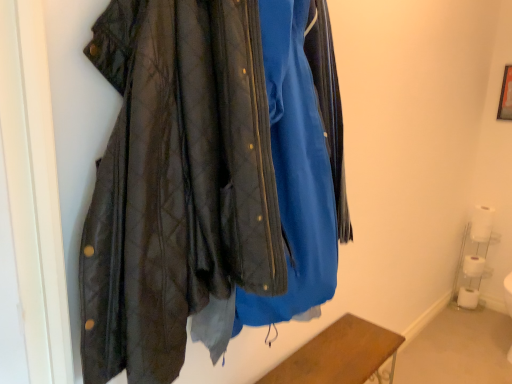
Identify the location of free space in front of white plastic shelf at lower right. This screenshot has height=384, width=512. (488, 322).